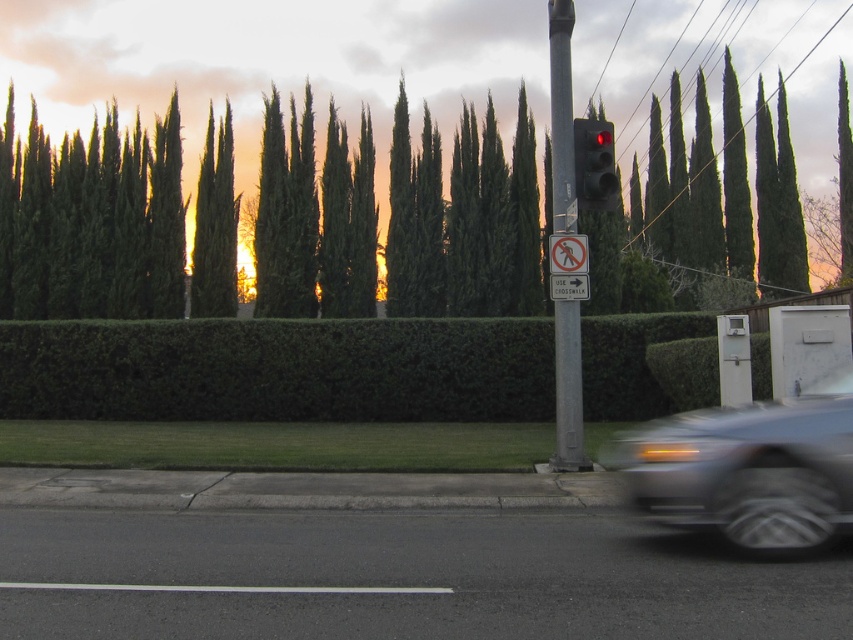
Is green leafy trees at upper center positioned in front of matte black traffic light at upper right?

No, it is behind matte black traffic light at upper right.

Who is more forward, [137,284] or [595,189]?

Point [595,189] is more forward.

You are a GUI agent. You are given a task and a screenshot of the screen. Output one action in this format:
    pyautogui.click(x=<x>, y=<y>)
    Task: Click on the green leafy trees at upper center
    The image size is (853, 640).
    Given the screenshot: What is the action you would take?
    pyautogui.click(x=91, y=221)

Is metallic gray car at lower right smaller than silver metallic pole at center?

Yes, metallic gray car at lower right is smaller than silver metallic pole at center.

Can you confirm if metallic gray car at lower right is bigger than silver metallic pole at center?

Actually, metallic gray car at lower right might be smaller than silver metallic pole at center.

Which is in front, point (776, 480) or point (555, 67)?

Point (776, 480)

Identify the location of metallic gray car at lower right. The height and width of the screenshot is (640, 853). (746, 472).

Is metallic wire at upper center shorter than white plastic pedestrian crossing sign at center?

No.

What do you see at coordinates (735, 49) in the screenshot?
I see `metallic wire at upper center` at bounding box center [735, 49].

This screenshot has height=640, width=853. What are the coordinates of `metallic wire at upper center` in the screenshot? It's located at (735, 49).